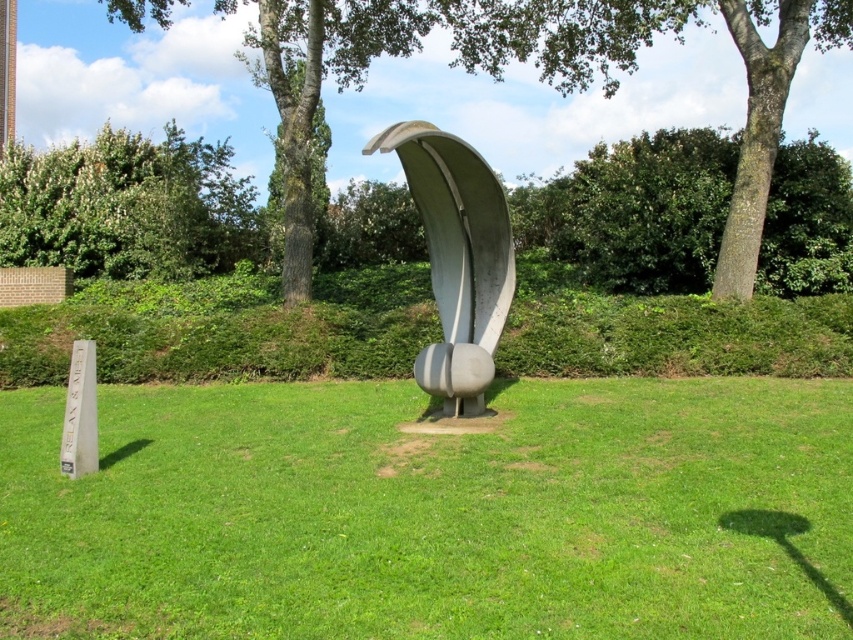
You are a gardener planning to water the green grass at center and the satin gray sculpture at center. Since the sculpture is made of metal, you need to avoid getting it wet. Which object should you direct the water away from?

You should direct the water away from the satin gray sculpture at center because it is made of metal and located above the green grass at center, so watering the grass below won

You are a gardener planning to mow the lawn. You see the green grass at center and the green leafy tree at upper left. Which area needs mowing first based on their sizes?

The green grass at center needs mowing first because it has a larger size compared to the green leafy tree at upper left.

You are standing in front of the satin gray sculpture at center and want to take a photo of the green leafy tree at upper left. Since the sculpture is in the way, can you move to the right side of the sculpture to get a clear view of the tree?

The green leafy tree at upper left is above the satin gray sculpture at center, so moving to the right side of the sculpture might still leave the tree visible above the sculpture. However, the exact visibility depends on the angle and distance, but since the tree is positioned above, you might need to adjust your position further to the right or lower your camera angle to frame the tree without the sculpture obstructing it.